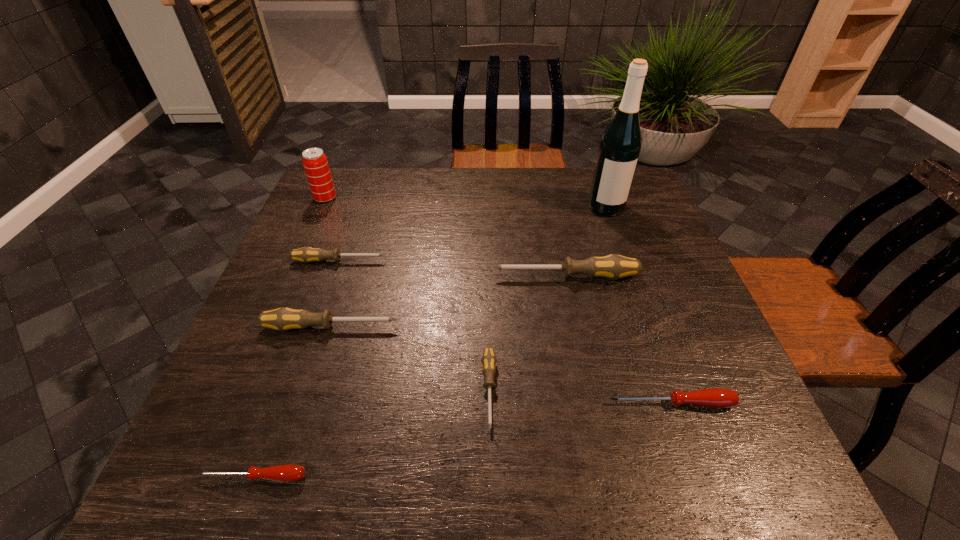
The image size is (960, 540). I want to click on the farther red screwdriver, so click(x=714, y=397).

Where is `the nearest gray screwdriver`? the nearest gray screwdriver is located at coordinates (488, 361).

The width and height of the screenshot is (960, 540). Find the location of `the nearest screwdriver`. the nearest screwdriver is located at coordinates (288, 472).

The image size is (960, 540). Find the location of `the smaller red screwdriver`. the smaller red screwdriver is located at coordinates (288, 472).

The height and width of the screenshot is (540, 960). I want to click on free space located on the label of the tallest object, so click(623, 254).

Locate an element on the screen. Image resolution: width=960 pixels, height=540 pixels. vacant region located on the right of the soda can is located at coordinates pos(402,198).

This screenshot has height=540, width=960. What are the coordinates of `free space located 0.130m at the tip of the tallest screwdriver` in the screenshot? It's located at (440, 276).

You are a GUI agent. You are given a task and a screenshot of the screen. Output one action in this format:
    pyautogui.click(x=<x>, y=<y>)
    Task: Click on the vacant space situated at the tip of the tallest screwdriver
    
    Given the screenshot: What is the action you would take?
    pyautogui.click(x=339, y=276)

At what (x,y) coordinates should I click in order to perform the action: click on vacant space located 0.290m at the tip of the tallest screwdriver. Please return your answer as a coordinate pair (x, y). The width and height of the screenshot is (960, 540). Looking at the image, I should click on (375, 276).

At what (x,y) coordinates should I click in order to perform the action: click on free point located 0.110m at the tip of the fifth farthest object. Please return your answer as a coordinate pair (x, y). Looking at the image, I should click on (448, 327).